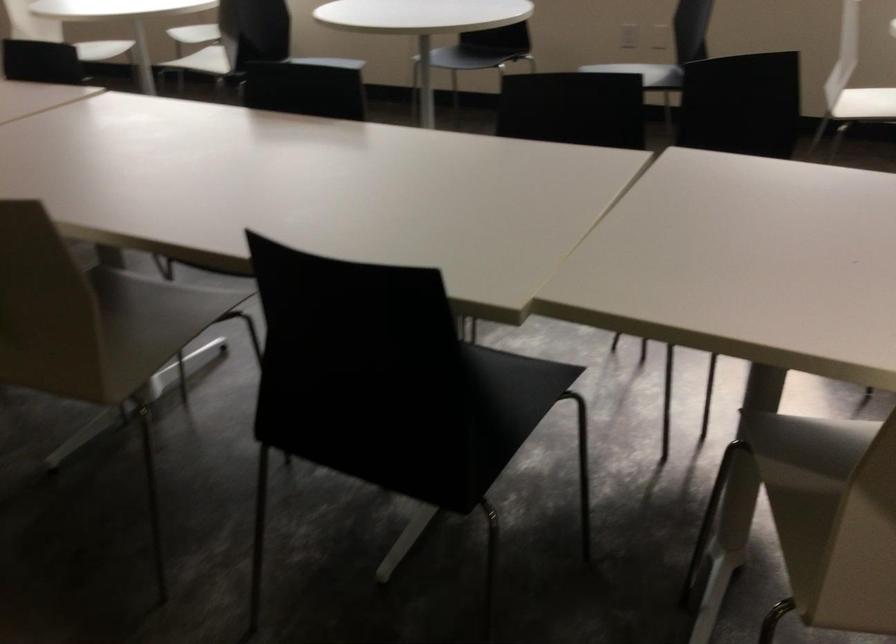
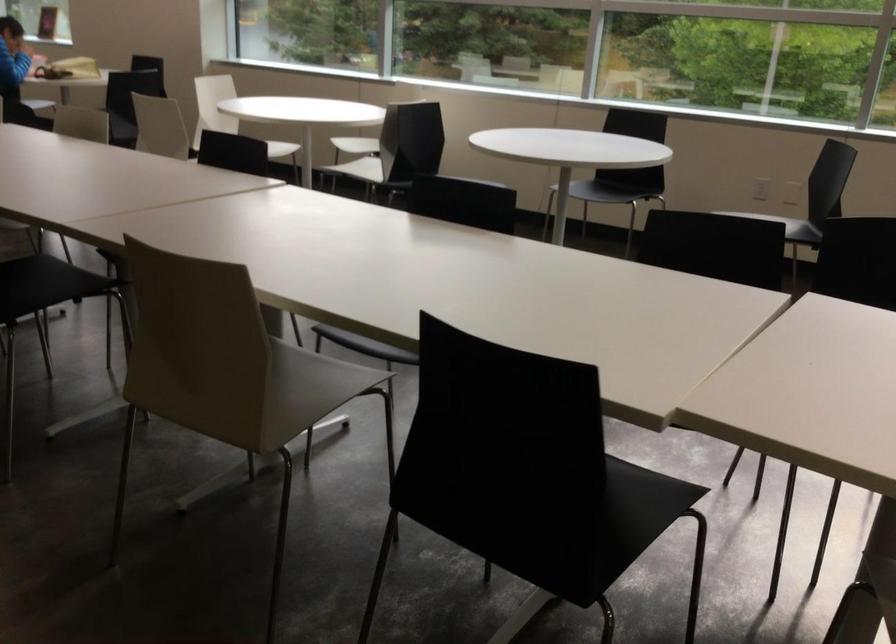
Find the pixel in the second image that matches (158,324) in the first image.

(306, 390)